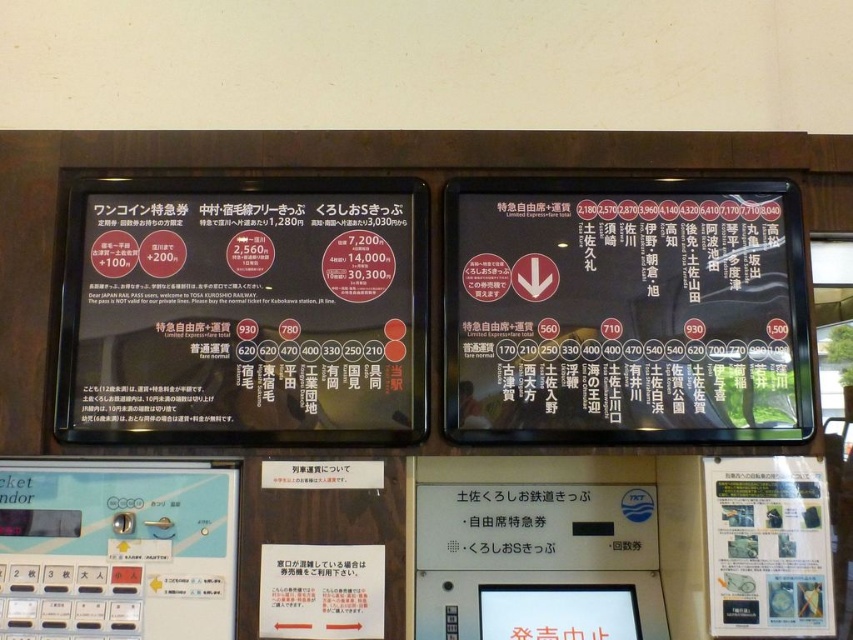
Can you confirm if black matte sign at upper right is positioned to the right of clear plastic sign at lower right?

Incorrect, black matte sign at upper right is not on the right side of clear plastic sign at lower right.

Who is taller, black matte sign at upper right or clear plastic sign at lower right?

black matte sign at upper right is taller.

Is point (482, 269) behind point (782, 563)?

Yes, it is behind point (782, 563).

This screenshot has height=640, width=853. I want to click on black matte sign at upper right, so click(x=625, y=310).

Between matte black signboard at left and clear plastic sign at lower right, which one appears on the left side from the viewer's perspective?

Answer: matte black signboard at left is more to the left.

Can you confirm if matte black signboard at left is taller than clear plastic sign at lower right?

Correct, matte black signboard at left is much taller as clear plastic sign at lower right.

Is point (412, 260) positioned after point (782, 584)?

Yes, point (412, 260) is behind point (782, 584).

This screenshot has width=853, height=640. What are the coordinates of `matte black signboard at left` in the screenshot? It's located at (244, 310).

Is point (108, 404) positioned behind point (544, 308)?

No, (108, 404) is in front of (544, 308).

Which of these two, matte black signboard at left or black matte sign at upper right, stands taller?

Standing taller between the two is black matte sign at upper right.

Is point (263, 321) farther from viewer compared to point (741, 296)?

No, it is in front of (741, 296).

Locate an element on the screen. The height and width of the screenshot is (640, 853). matte black signboard at left is located at coordinates (244, 310).